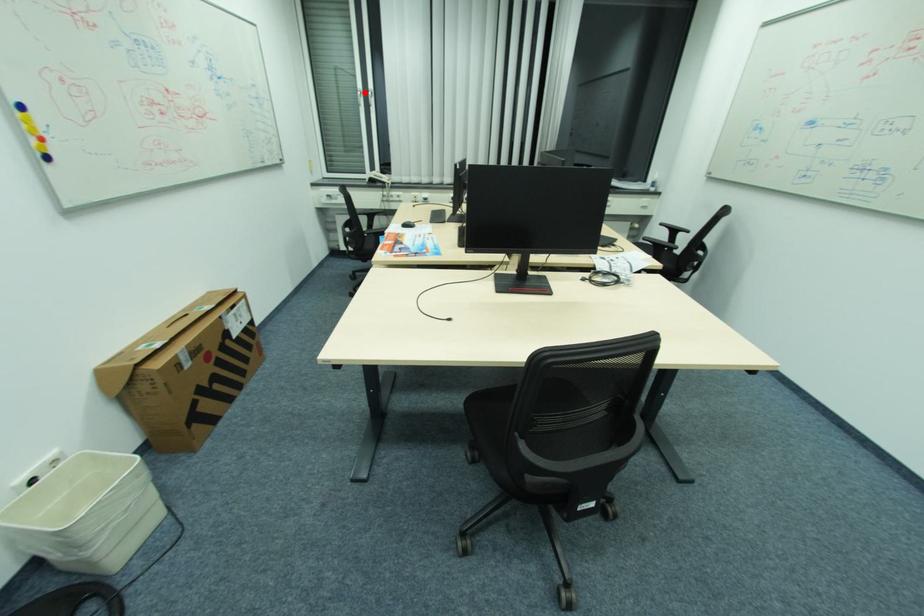
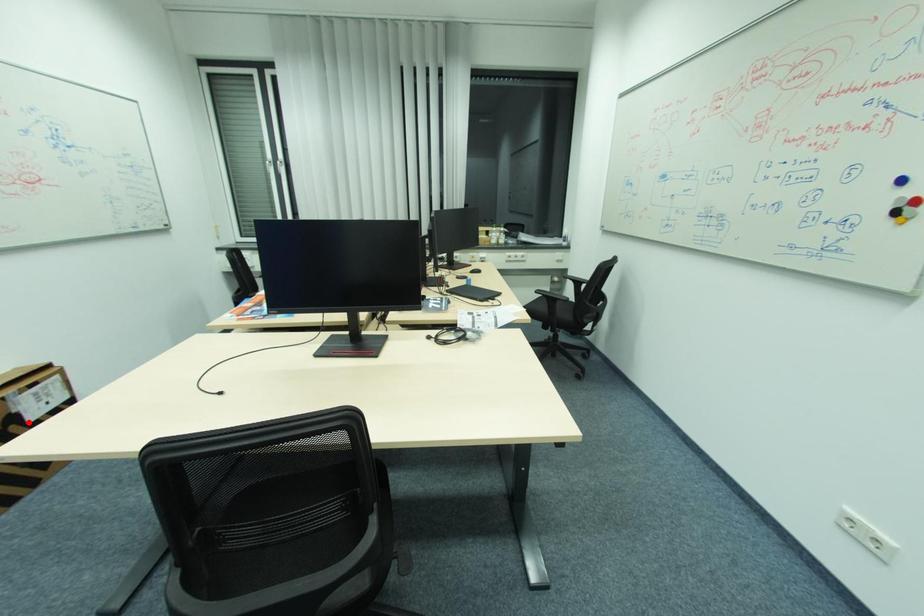
Based on the photo, I am providing you with two images of the same scene from different viewpoints. A red point is marked on the first image and another point is marked on the second image. Are the points marked in image1 and image2 representing the same 3D position?

No